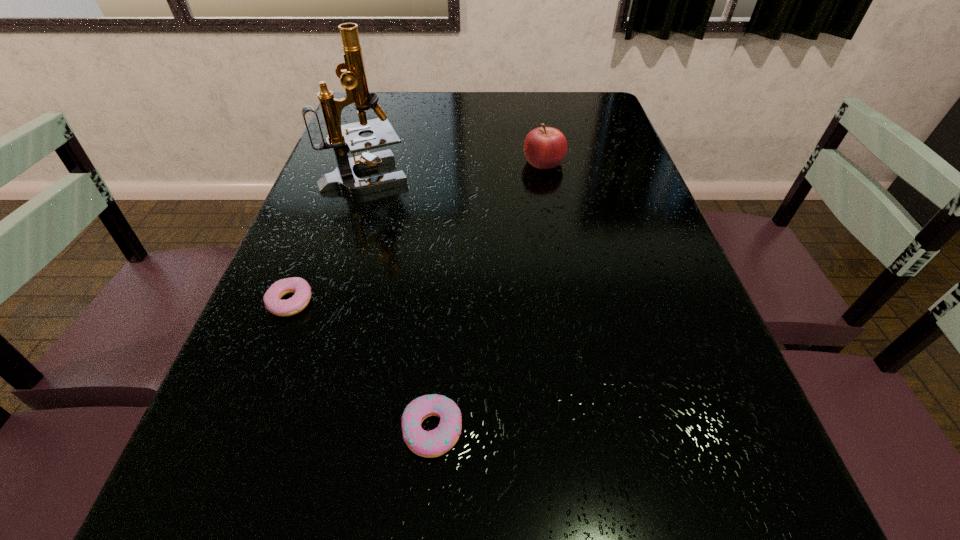
This screenshot has height=540, width=960. In order to click on vacant position located 0.190m on the back of the third farthest object in this screenshot , I will do `click(321, 226)`.

Where is `microscope positioned at the left edge`? microscope positioned at the left edge is located at coordinates (342, 138).

Where is `doughnut located in the left edge section of the desktop`? This screenshot has height=540, width=960. doughnut located in the left edge section of the desktop is located at coordinates (302, 291).

Image resolution: width=960 pixels, height=540 pixels. Identify the location of vacant space at the far edge. (427, 116).

At what (x,y) coordinates should I click in order to perform the action: click on vacant space at the left edge of the desktop. Please return your answer as a coordinate pair (x, y). This screenshot has width=960, height=540. Looking at the image, I should click on (332, 164).

In the image, there is a desktop. Identify the location of vacant space at the right edge. (623, 156).

This screenshot has width=960, height=540. In order to click on free space at the far left corner of the desktop in this screenshot , I will do `click(382, 103)`.

This screenshot has height=540, width=960. In order to click on blank space at the far right corner of the desktop in this screenshot , I will do `click(582, 103)`.

The image size is (960, 540). In order to click on blank region between the nearest object and the microscope in this screenshot , I will do `click(398, 302)`.

Locate an element on the screen. This screenshot has width=960, height=540. vacant space in between the rightmost object and the microscope is located at coordinates pos(455,168).